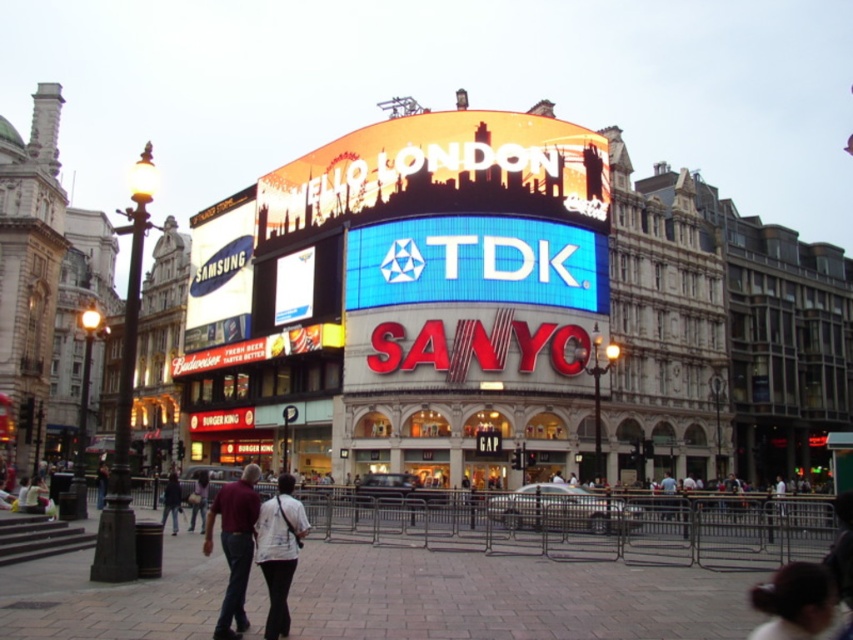
You are a tourist in London and see the billboard with the text HELLO LONDON at the top. You notice a point at coordinates (234, 545) on the image. What object is located at that point?

The point at coordinates (234, 545) corresponds to the white cotton shirt at center.

You are a fashion designer observing the scene in Piccadilly Circus. You notice a white cotton shirt at center and a dark blue jacket at center. Which clothing item is positioned higher in the image?

The white cotton shirt at center is positioned higher than the dark blue jacket at center.

You are a tourist standing at Piccadilly Circus in London and notice an object labeled dark blue jeans at center. Based on its coordinates, can you determine if it is located in the lower half of the image?

The dark blue jeans at center is located at coordinates point (x=198, y=499). Since the y coordinate is 0.233, which is below 0.5, it is in the lower half of the image.